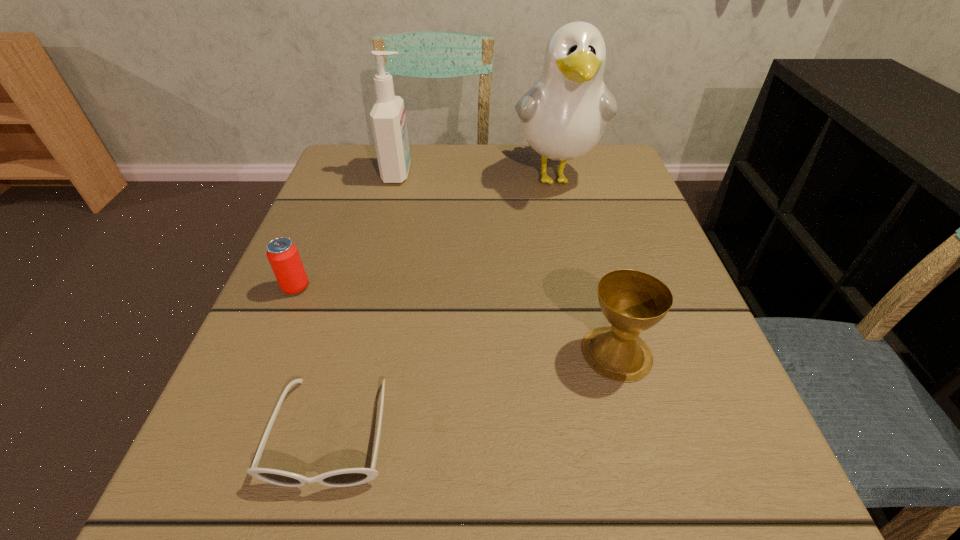
The width and height of the screenshot is (960, 540). What are the coordinates of `vacant point located between the sunglasses and the leftmost object` in the screenshot? It's located at (314, 360).

Where is `vacant space that's between the sunglasses and the tallest object`? This screenshot has width=960, height=540. vacant space that's between the sunglasses and the tallest object is located at coordinates (444, 304).

You are a GUI agent. You are given a task and a screenshot of the screen. Output one action in this format:
    pyautogui.click(x=<x>, y=<y>)
    Task: Click on the blank region between the second tallest object and the gull
    Image resolution: width=960 pixels, height=540 pixels.
    Given the screenshot: What is the action you would take?
    pyautogui.click(x=477, y=175)

Identify the location of unoccupied area between the shortest object and the cleansing agent. (365, 302).

Find the location of `vacant point located between the shortest object and the chalice`. vacant point located between the shortest object and the chalice is located at coordinates (474, 393).

At what (x,y) coordinates should I click in order to perform the action: click on empty location between the third farthest object and the sunglasses. Please return your answer as a coordinate pair (x, y). This screenshot has height=540, width=960. Looking at the image, I should click on (314, 360).

This screenshot has width=960, height=540. I want to click on vacant area that lies between the gull and the beer can, so click(425, 232).

This screenshot has width=960, height=540. Find the location of `object that stands as the fourth closest to the leftmost object`. object that stands as the fourth closest to the leftmost object is located at coordinates (632, 301).

Identify which object is the nearest to the fourth shortest object. Please provide its 2D coordinates. Your answer should be formatted as a tuple, i.e. [(x, y)], where the tuple contains the x and y coordinates of a point satisfying the conditions above.

[(563, 116)]

The height and width of the screenshot is (540, 960). I want to click on free space that satisfies the following two spatial constraints: 1. on the beak of the tallest object; 2. on the left side of the chalice, so click(596, 353).